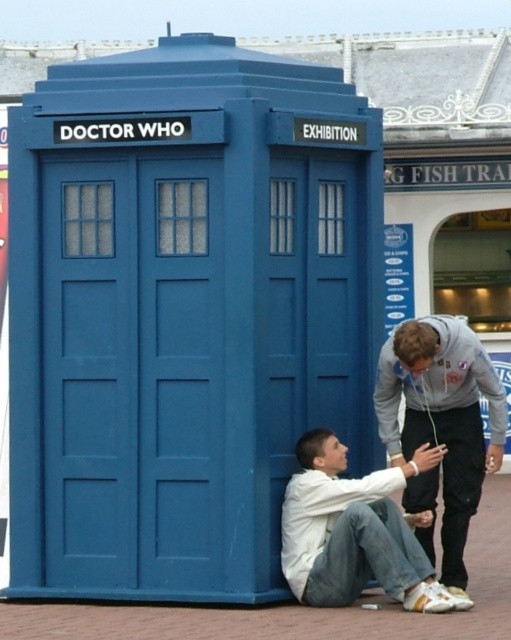
You are a photographer trying to capture a photo of the TARDIS with both the gray hoodie at lower right and white matte shirt at lower center in the frame. Based on their positions, which person should be placed on the right side of the TARDIS to ensure both are visible in the photo?

The gray hoodie at lower right should be placed on the right side of the TARDIS because it is already positioned on the right side of the white matte shirt at lower center, so positioning them further right would keep both in frame.

You are planning to take a photo of the gray hoodie at lower right and the white matte shirt at lower center in front of the TARDIS. Since you want both to be clearly visible, which person should be positioned closer to the camera to avoid being obscured?

The gray hoodie at lower right is thinner than the white matte shirt at lower center. To ensure both are clearly visible, the gray hoodie at lower right should be positioned closer to the camera since its thinner form might be less likely to block the other person.

Consider the image. You are standing at the point marked by the coordinates point (443, 419). What object or person are you directly facing in the scene?

The point (443, 419) marks the gray hoodie at lower right, so you are directly facing the gray hoodie at lower right.